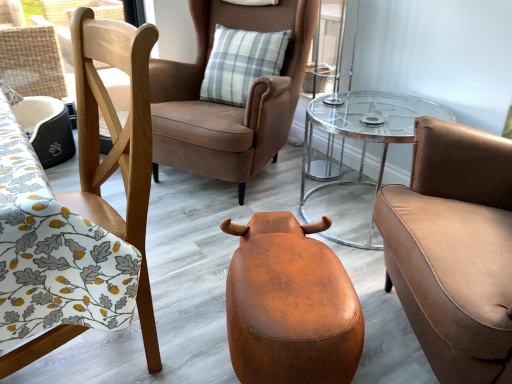
Question: Is matte brown leather armchair at right, marked as the first chair in a right-to-left arrangement, at the left side of clear glass table at center?

Choices:
 (A) yes
 (B) no

Answer: (B)

Question: Considering the relative sizes of matte brown leather armchair at right, marked as the first chair in a right-to-left arrangement, and clear glass table at center in the image provided, is matte brown leather armchair at right, marked as the first chair in a right-to-left arrangement, taller than clear glass table at center?

Choices:
 (A) no
 (B) yes

Answer: (B)

Question: Is matte brown leather armchair at right, marked as the first chair in a right-to-left arrangement, positioned with its back to clear glass table at center?

Choices:
 (A) yes
 (B) no

Answer: (B)

Question: Is matte brown leather armchair at right, marked as the first chair in a right-to-left arrangement, not inside clear glass table at center?

Choices:
 (A) no
 (B) yes

Answer: (B)

Question: Considering the relative sizes of matte brown leather armchair at right, positioned as the 3th chair in left-to-right order, and clear glass table at center in the image provided, is matte brown leather armchair at right, positioned as the 3th chair in left-to-right order, thinner than clear glass table at center?

Choices:
 (A) no
 (B) yes

Answer: (A)

Question: Can you confirm if matte brown leather armchair at right, marked as the first chair in a right-to-left arrangement, is bigger than clear glass table at center?

Choices:
 (A) no
 (B) yes

Answer: (B)

Question: Does clear glass table at center turn towards matte brown leather armchair at right, marked as the first chair in a right-to-left arrangement?

Choices:
 (A) yes
 (B) no

Answer: (B)

Question: Is clear glass table at center positioned behind matte brown leather armchair at right, marked as the first chair in a right-to-left arrangement?

Choices:
 (A) no
 (B) yes

Answer: (B)

Question: From a real-world perspective, is clear glass table at center located beneath matte brown leather armchair at right, positioned as the 3th chair in left-to-right order?

Choices:
 (A) no
 (B) yes

Answer: (B)

Question: Is clear glass table at center thinner than matte brown leather armchair at right, marked as the first chair in a right-to-left arrangement?

Choices:
 (A) no
 (B) yes

Answer: (B)

Question: Is clear glass table at center shorter than matte brown leather armchair at right, positioned as the 3th chair in left-to-right order?

Choices:
 (A) yes
 (B) no

Answer: (A)

Question: Is clear glass table at center turned away from matte brown leather armchair at right, marked as the first chair in a right-to-left arrangement?

Choices:
 (A) yes
 (B) no

Answer: (B)

Question: Is clear glass table at center positioned beyond the bounds of brown leather chair at center, marked as the 2th chair in a right-to-left arrangement?

Choices:
 (A) no
 (B) yes

Answer: (B)